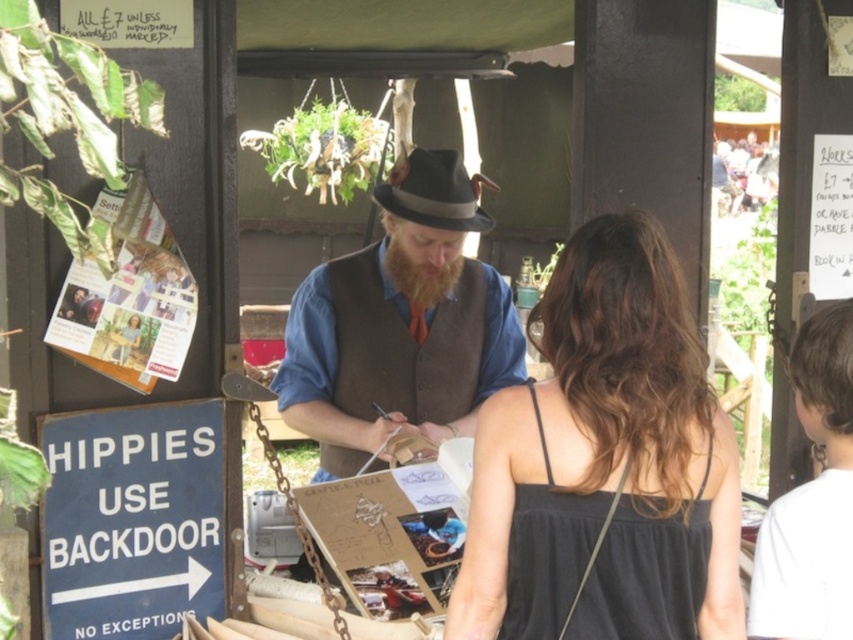
Question: Which object is closer to the camera taking this photo?

Choices:
 (A) brown woolen vest at center
 (B) dark brown fuzzy beard at center
 (C) gray felt fedora at center

Answer: (C)

Question: From the image, what is the correct spatial relationship of brown woolen vest at center in relation to gray felt fedora at center?

Choices:
 (A) above
 (B) below

Answer: (B)

Question: Which object appears farthest from the camera in this image?

Choices:
 (A) gray felt fedora at center
 (B) brown woolen vest at center
 (C) black fabric dress at center

Answer: (B)

Question: Is the position of gray felt fedora at center less distant than that of dark brown fuzzy beard at center?

Choices:
 (A) no
 (B) yes

Answer: (B)

Question: Which of these objects is positioned closest to the black satin dress at center?

Choices:
 (A) black fabric dress at center
 (B) brown woolen vest at center
 (C) gray felt fedora at center
 (D) dark brown fuzzy beard at center

Answer: (A)

Question: Where is black satin dress at center located in relation to dark brown fuzzy beard at center in the image?

Choices:
 (A) above
 (B) below

Answer: (B)